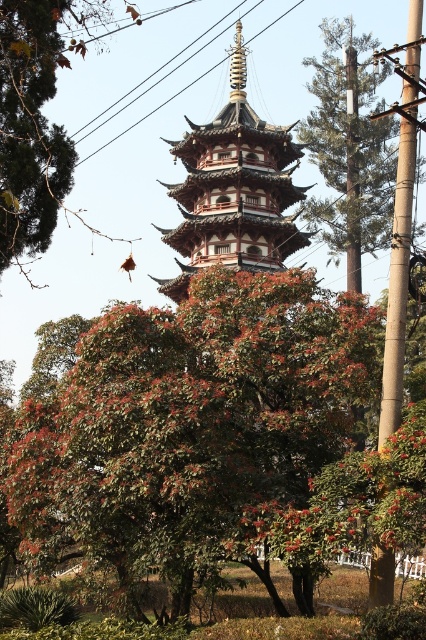
Question: Can you confirm if green glossy tree at center is thinner than black wire at upper center?

Choices:
 (A) no
 (B) yes

Answer: (A)

Question: Which of the following is the farthest from the observer?

Choices:
 (A) brown matte tree at upper left
 (B) wooden pagoda at center

Answer: (B)

Question: Does wooden pagoda at center appear on the right side of bamboo pole at right?

Choices:
 (A) yes
 (B) no

Answer: (B)

Question: Does green glossy tree at center appear under wooden pagoda at center?

Choices:
 (A) yes
 (B) no

Answer: (A)

Question: Estimate the real-world distances between objects in this image. Which object is farther from the bamboo pole at right?

Choices:
 (A) wooden pagoda at center
 (B) black wire at upper center

Answer: (B)

Question: Which object is the closest to the bamboo pole at right?

Choices:
 (A) green glossy tree at center
 (B) black wire at upper center
 (C) green textured tree at upper right
 (D) wooden pagoda at center

Answer: (A)